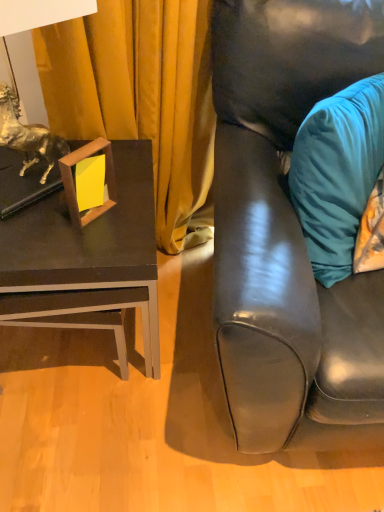
The height and width of the screenshot is (512, 384). Find the location of `woodenobject at left`. woodenobject at left is located at coordinates (74, 180).

The image size is (384, 512). What do you see at coordinates (288, 232) in the screenshot?
I see `matte black couch at right` at bounding box center [288, 232].

The height and width of the screenshot is (512, 384). Identify the location of teal velvet pillow at right. (337, 173).

This screenshot has height=512, width=384. I want to click on matte black table at left, so click(x=87, y=254).

At what (x,y) coordinates should I click in order to perform the action: click on woodenobject at left. Please return your answer as a coordinate pair (x, y). The width and height of the screenshot is (384, 512). Looking at the image, I should click on (74, 180).

Do you think matte black couch at right is within teal velvet pillow at right, or outside of it?

matte black couch at right is not enclosed by teal velvet pillow at right.

Is matte black couch at right wider or thinner than teal velvet pillow at right?

Considering their sizes, matte black couch at right looks broader than teal velvet pillow at right.

Does matte black couch at right turn towards teal velvet pillow at right?

Yes, matte black couch at right faces towards teal velvet pillow at right.

From a real-world perspective, is matte black couch at right physically below teal velvet pillow at right?

Yes, from a real-world perspective, matte black couch at right is below teal velvet pillow at right.

Considering the relative positions of woodenobject at left and matte black couch at right in the image provided, is woodenobject at left to the left or to the right of matte black couch at right?

woodenobject at left is to the left of matte black couch at right.

Based on the photo, is woodenobject at left looking in the opposite direction of matte black couch at right?

No, woodenobject at left is not facing the opposite direction of matte black couch at right.

From a real-world perspective, relative to matte black couch at right, is woodenobject at left vertically above or below?

In terms of real-world spatial position, woodenobject at left is above matte black couch at right.

Does point (292, 276) come farther from viewer compared to point (10, 317)?

No.

Who is taller, matte black couch at right or matte black table at left?

Standing taller between the two is matte black couch at right.

From the image's perspective, does matte black couch at right appear lower than matte black table at left?

No, from the image's perspective, matte black couch at right is not below matte black table at left.

Between matte black couch at right and matte black table at left, which one has larger size?

Bigger between the two is matte black couch at right.

Does teal velvet pillow at right contain woodenobject at left?

No, woodenobject at left is not surrounded by teal velvet pillow at right.

Who is bigger, teal velvet pillow at right or woodenobject at left?

teal velvet pillow at right is bigger.

Is teal velvet pillow at right oriented away from woodenobject at left?

No, teal velvet pillow at right's orientation is not away from woodenobject at left.

I want to click on pillow above the woodenobject at left (from a real-world perspective), so click(x=337, y=173).

Image resolution: width=384 pixels, height=512 pixels. Identify the location of pillow above the matte black table at left (from a real-world perspective). (337, 173).

Does point (311, 260) appear closer or farther from the camera than point (68, 285)?

Point (311, 260) is farther from the camera than point (68, 285).

Looking at this image, from the image's perspective, does teal velvet pillow at right appear higher than matte black table at left?

Yes, from the image's perspective, teal velvet pillow at right is over matte black table at left.

In the scene shown: Is teal velvet pillow at right far away from matte black table at left?

teal velvet pillow at right is near matte black table at left, not far away.

Would you say matte black table at left is inside or outside woodenobject at left?

matte black table at left is outside woodenobject at left.

Does matte black table at left have a larger size compared to woodenobject at left?

Yes.

Is point (124, 234) farther from camera compared to point (91, 150)?

Yes, point (124, 234) is behind point (91, 150).

Is there a large distance between teal velvet pillow at right and matte black couch at right?

They are positioned close to each other.

Looking at the image, does teal velvet pillow at right seem bigger or smaller compared to matte black couch at right?

teal velvet pillow at right is smaller than matte black couch at right.

I want to click on pillow behind the matte black couch at right, so click(337, 173).

This screenshot has height=512, width=384. Identify the location of studio couch below the teal velvet pillow at right (from a real-world perspective). (288, 232).

Image resolution: width=384 pixels, height=512 pixels. In order to click on studio couch in front of the woodenobject at left in this screenshot , I will do `click(288, 232)`.

Looking at the image, which one is located closer to woodenobject at left, matte black couch at right or teal velvet pillow at right?

matte black couch at right lies closer to woodenobject at left than the other object.

When comparing their distances from matte black table at left, does matte black couch at right or woodenobject at left seem further?

The object further to matte black table at left is matte black couch at right.

Based on their spatial positions, is woodenobject at left or teal velvet pillow at right further from matte black table at left?

teal velvet pillow at right lies further to matte black table at left than the other object.

Based on their spatial positions, is woodenobject at left or matte black table at left closer to teal velvet pillow at right?

Among the two, matte black table at left is located nearer to teal velvet pillow at right.

In the scene shown: Estimate the real-world distances between objects in this image. Which object is further from woodenobject at left, matte black table at left or matte black couch at right?

Among the two, matte black couch at right is located further to woodenobject at left.

From the image, which object appears to be farther from teal velvet pillow at right, woodenobject at left or matte black couch at right?

Based on the image, woodenobject at left appears to be further to teal velvet pillow at right.

Considering their positions, is woodenobject at left positioned further to matte black table at left than matte black couch at right?

matte black couch at right.

Looking at the image, which one is located closer to woodenobject at left, matte black couch at right or matte black table at left?

Among the two, matte black table at left is located nearer to woodenobject at left.

This screenshot has height=512, width=384. I want to click on picture frame between matte black table at left and teal velvet pillow at right from left to right, so click(x=74, y=180).

Locate an element on the screen. This screenshot has width=384, height=512. pillow between matte black table at left and matte black couch at right is located at coordinates (337, 173).

Identify the location of picture frame between matte black table at left and matte black couch at right from left to right. The image size is (384, 512). 74,180.

The height and width of the screenshot is (512, 384). In order to click on pillow situated between woodenobject at left and matte black couch at right from left to right in this screenshot , I will do `click(337, 173)`.